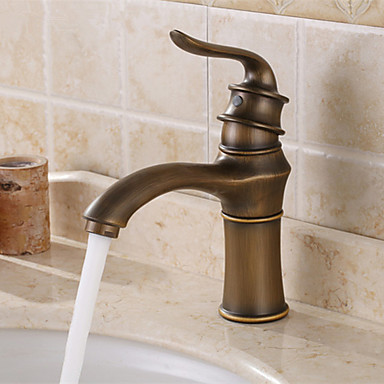
Locate an element on the screen. The height and width of the screenshot is (384, 384). wall is located at coordinates (334, 11).